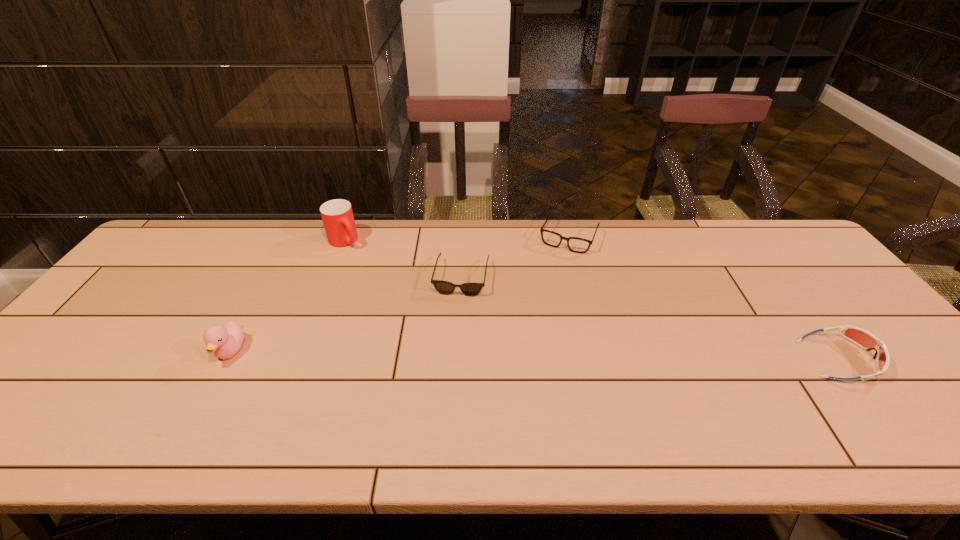
The image size is (960, 540). What are the coordinates of `free point between the third object from left to right and the rightmost object` in the screenshot? It's located at (650, 319).

Locate an element on the screen. blank region between the spectacles and the cup is located at coordinates (457, 239).

You are a GUI agent. You are given a task and a screenshot of the screen. Output one action in this format:
    pyautogui.click(x=<x>, y=<y>)
    Task: Click on the vacant point located between the leftmost object and the sunglasses
    The height and width of the screenshot is (540, 960).
    Given the screenshot: What is the action you would take?
    pyautogui.click(x=347, y=314)

Identify the location of vacant area that lies between the duckling and the rightmost object. Image resolution: width=960 pixels, height=540 pixels. (535, 355).

What are the coordinates of `unoccupied area between the duckling and the sunglasses` in the screenshot? It's located at (347, 314).

Find the location of a particular element. free space between the third nearest object and the rightmost object is located at coordinates (650, 319).

The width and height of the screenshot is (960, 540). Find the location of `free spot between the spectacles and the goggles`. free spot between the spectacles and the goggles is located at coordinates (705, 298).

Where is `vacant space in between the rightmost object and the third object from left to right`? This screenshot has height=540, width=960. vacant space in between the rightmost object and the third object from left to right is located at coordinates (650, 319).

Identify the location of vacant space that's between the goggles and the spectacles. The image size is (960, 540). (705, 298).

Locate an element on the screen. The width and height of the screenshot is (960, 540). object that stands as the closest to the third object from left to right is located at coordinates (577, 245).